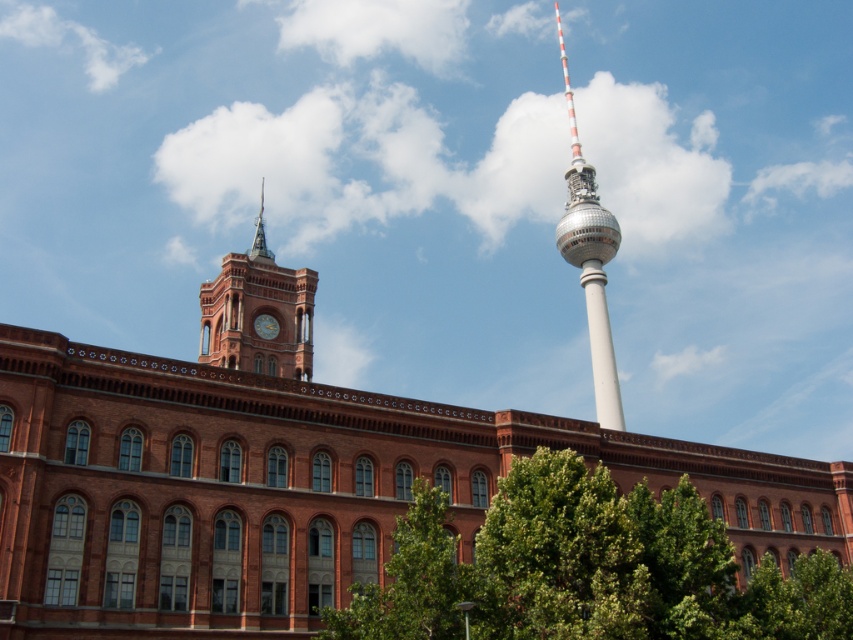
Is shiny silver spire at upper left positioned in front of golden metallic clock at upper left?

No, it is behind golden metallic clock at upper left.

Consider the image. Who is positioned more to the left, shiny silver spire at upper left or golden metallic clock at upper left?

shiny silver spire at upper left is more to the left.

You are a GUI agent. You are given a task and a screenshot of the screen. Output one action in this format:
    pyautogui.click(x=<x>, y=<y>)
    Task: Click on the shiny silver spire at upper left
    This screenshot has height=640, width=853.
    Given the screenshot: What is the action you would take?
    pyautogui.click(x=259, y=236)

The height and width of the screenshot is (640, 853). What are the coordinates of `shiny silver spire at upper left` in the screenshot? It's located at (259, 236).

Is point (605, 368) farther from viewer compared to point (256, 328)?

Yes, point (605, 368) is behind point (256, 328).

Between point (585, 291) and point (260, 333), which one is positioned behind?

Point (585, 291)

Who is more distant from viewer, (x=590, y=269) or (x=264, y=326)?

Positioned behind is point (x=590, y=269).

The width and height of the screenshot is (853, 640). Identify the location of white glossy tower at center. (590, 262).

Is green leafy tree at center to the right of golden metallic clock at upper left from the viewer's perspective?

Yes, green leafy tree at center is to the right of golden metallic clock at upper left.

This screenshot has height=640, width=853. I want to click on green leafy tree at center, so click(x=587, y=568).